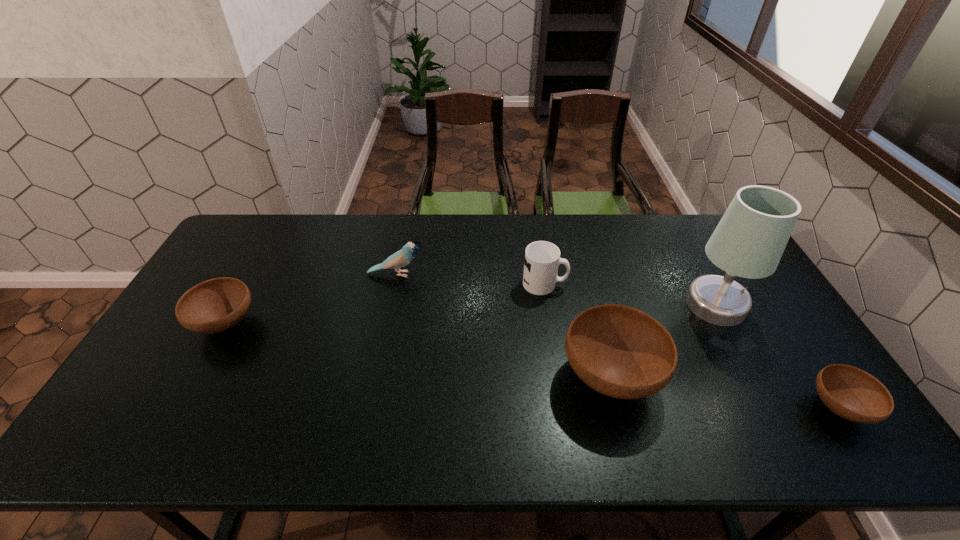
Where is `vacant region at the left edge of the desktop`? vacant region at the left edge of the desktop is located at coordinates (201, 367).

You are a GUI agent. You are given a task and a screenshot of the screen. Output one action in this format:
    pyautogui.click(x=<x>, y=<y>)
    Task: Click on the vacant space at the right edge of the desktop
    
    Given the screenshot: What is the action you would take?
    pyautogui.click(x=741, y=333)

Where is `free space at the far left corner`? The image size is (960, 540). free space at the far left corner is located at coordinates (252, 247).

What are the coordinates of `empty location between the mug and the second object from right to left` in the screenshot? It's located at (630, 294).

Where is `vacant area that lies between the tallest bowl and the bird`? vacant area that lies between the tallest bowl and the bird is located at coordinates (503, 325).

Find the location of a particular element. The height and width of the screenshot is (540, 960). vacant area that lies between the tallest object and the shortest object is located at coordinates (777, 356).

The image size is (960, 540). I want to click on vacant area between the fifth object from right to left and the tallest bowl, so click(503, 325).

At what (x,y) coordinates should I click in order to perform the action: click on vacant area that lies between the bird and the leftmost bowl. Please return your answer as a coordinate pair (x, y). Looking at the image, I should click on (311, 299).

Locate an element on the screen. This screenshot has height=540, width=960. free area in between the bird and the second tallest bowl is located at coordinates (311, 299).

I want to click on vacant space that's between the shortest object and the leftmost bowl, so click(x=532, y=366).